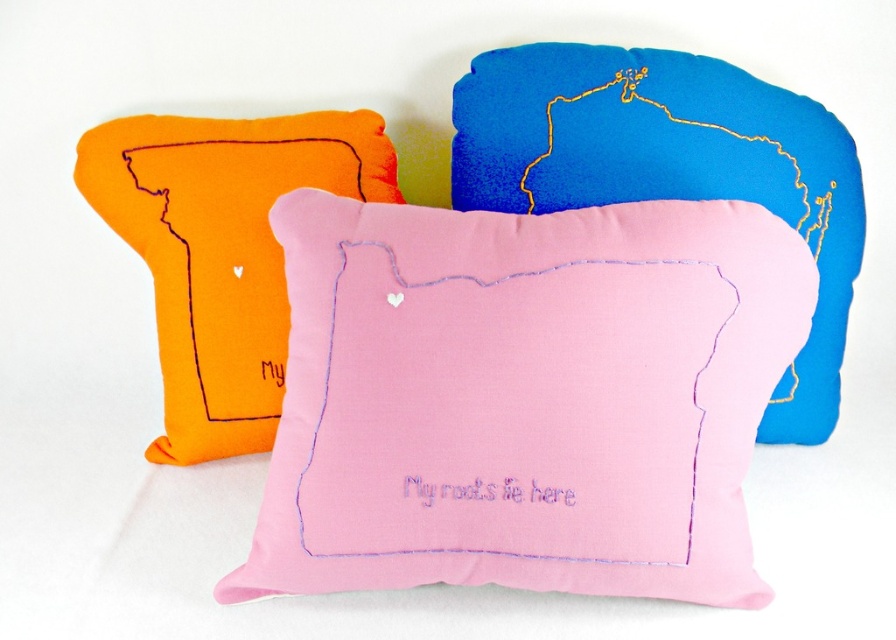
You are a photographer standing 5 feet away from the pink fabric cushion at center. You want to take a closeup shot of the cushion. Can you move closer to get a better shot without moving the cushion?

The pink fabric cushion at center is 4.28 feet away from camera. Since you are currently 5 feet away, you can move 0.72 feet closer to reach the cushion and take the closeup shot.

You are arranging these pillows on a shelf that can only hold items up to 12 inches wide. The pink fabric pillow at center and the orange felt pillow at left are both placed side by side. Which one is wider?

The pink fabric pillow at center might be wider than orange felt pillow at left, so the pink one is likely wider.

You are arranging these pillows for a display. If you want to place a decorative item in front of the pink fabric cushion at center, where should you place it relative to the pink fabric pillow at center?

You should place the decorative item in front of the pink fabric pillow at center because it is closer to the viewer than the pink fabric cushion at center, so placing something in front of the cushion would require positioning it in front of the pillow as well.